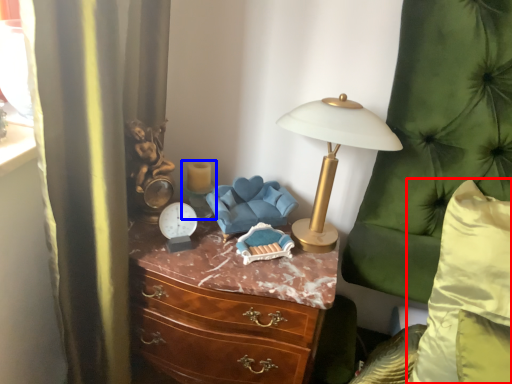
Question: Among these objects, which one is farthest to the camera, pillow (highlighted by a red box) or candle holder (highlighted by a blue box)?

Choices:
 (A) pillow
 (B) candle holder

Answer: (B)